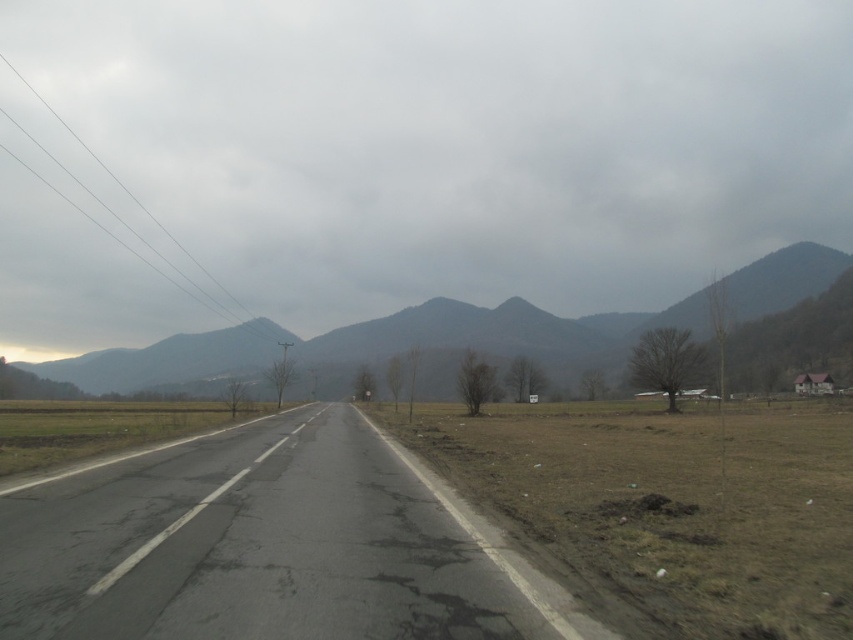
How far apart are gray cloudy sky at upper center and asphalt road at center?

They are 173.06 meters apart.

Which is below, gray cloudy sky at upper center or asphalt road at center?

asphalt road at center is below.

Is point (114, 128) in front of point (352, 630)?

No, (114, 128) is further to viewer.

Locate an element on the screen. gray cloudy sky at upper center is located at coordinates (460, 141).

Is gray cloudy sky at upper center behind gray rocky mountain at center?

Yes, gray cloudy sky at upper center is further from the viewer.

Does point (80, 250) come closer to viewer compared to point (535, 323)?

No, it is not.

The height and width of the screenshot is (640, 853). Find the location of `gray cloudy sky at upper center`. gray cloudy sky at upper center is located at coordinates (460, 141).

Where is `gray cloudy sky at upper center`? gray cloudy sky at upper center is located at coordinates (460, 141).

Which is behind, point (120, 531) or point (618, 328)?

The point (618, 328) is behind.

Does asphalt road at center come in front of gray rocky mountain at center?

Yes, asphalt road at center is in front of gray rocky mountain at center.

The width and height of the screenshot is (853, 640). What do you see at coordinates (265, 545) in the screenshot? I see `asphalt road at center` at bounding box center [265, 545].

Locate an element on the screen. The width and height of the screenshot is (853, 640). asphalt road at center is located at coordinates (265, 545).